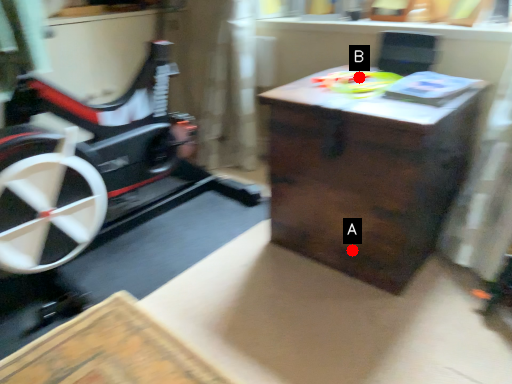
Question: Two points are circled on the image, labeled by A and B beside each circle. Which of the following is the farthest from the observer?

Choices:
 (A) A is further
 (B) B is further

Answer: (B)